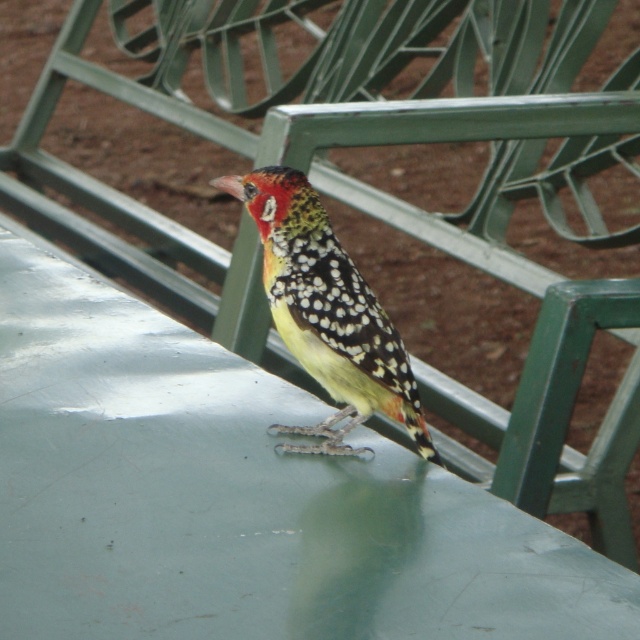
Does green matte table at center appear over speckled feathered bird at center?

No.

Which is in front, point (474, 518) or point (305, 301)?

Point (474, 518)

Is point (362, 518) farther from camera compared to point (346, 284)?

No.

Identify the location of green matte table at center. The height and width of the screenshot is (640, 640). (237, 499).